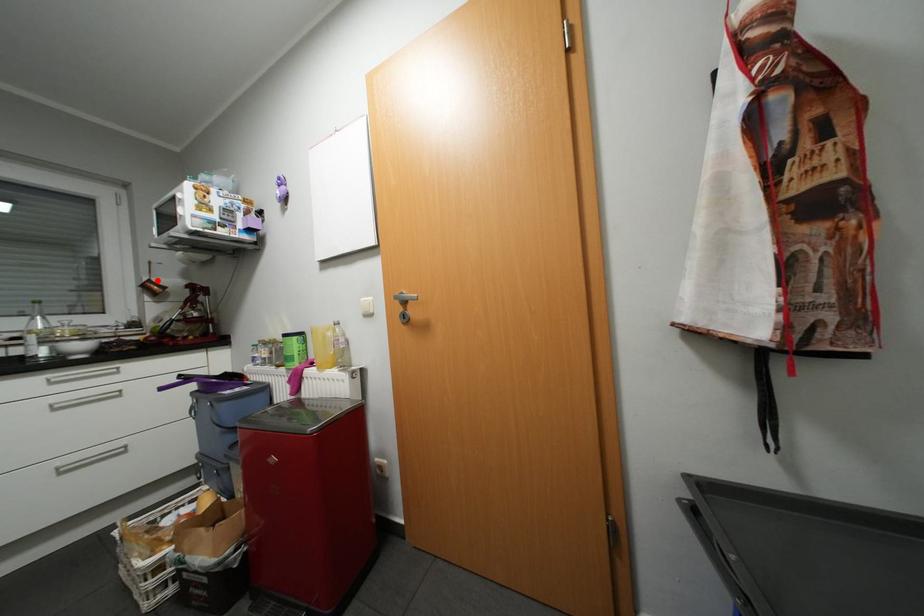
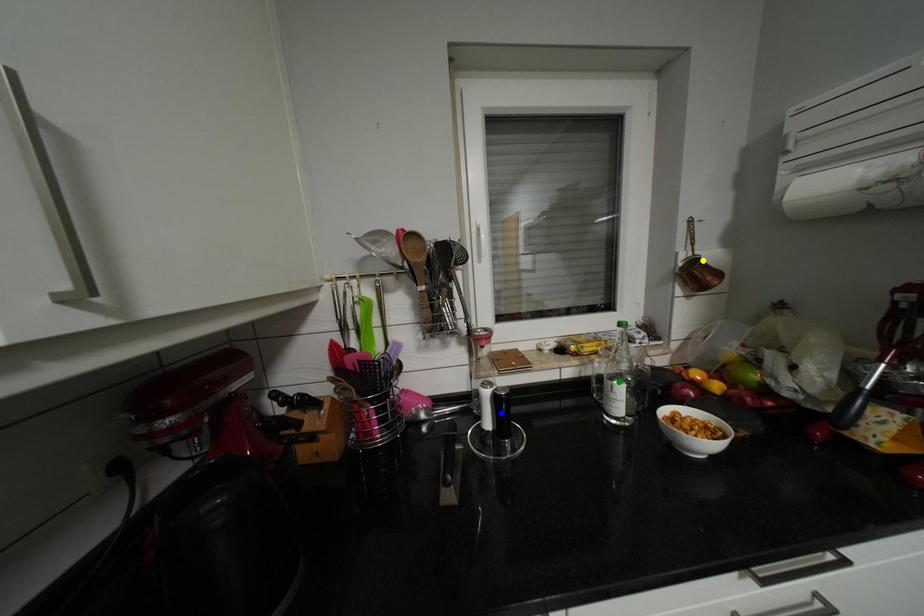
Question: I am providing you with two images of the same scene from different viewpoints. A red point is marked on the first image. You are given multiple points on the second image. Can you choose the point in image 2 that corresponds to the point in image 1?

Choices:
 (A) yellow point
 (B) blue point
 (C) green point

Answer: (A)